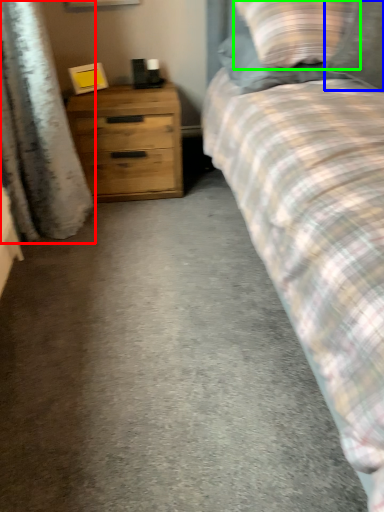
Question: Estimate the real-world distances between objects in this image. Which object is closer to curtain (highlighted by a red box), pillow (highlighted by a blue box) or pillow (highlighted by a green box)?

Choices:
 (A) pillow
 (B) pillow

Answer: (B)